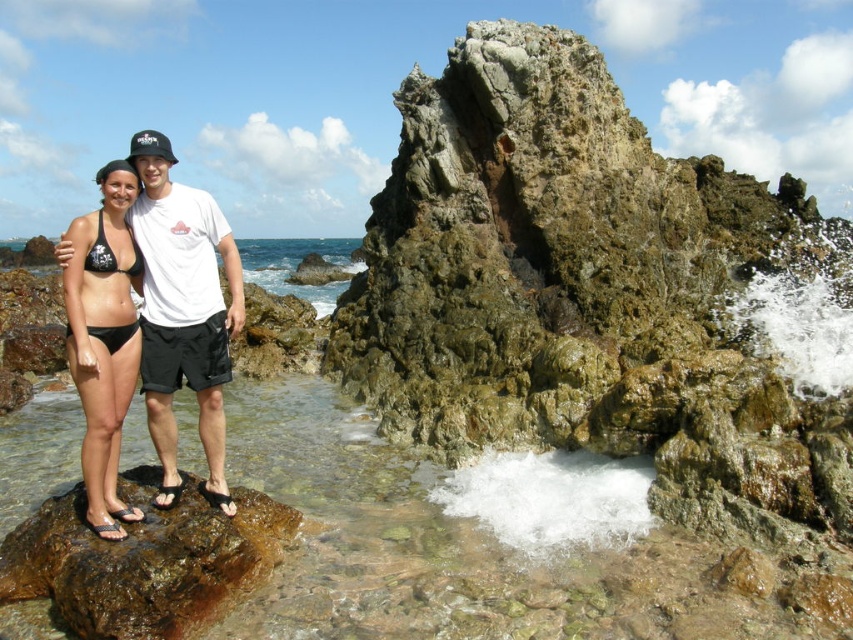
You are a photographer trying to capture both points in the image. Which point, point (395, 314) or point (67, 520), is closer to your camera lens?

Point (395, 314) is closer to the camera lens because it is further to the viewer than point (67, 520).

You are a photographer planning to take a portrait of the two people in the scene. You want to ensure that both the green mossy rock at center and the brown rough rock at lower left are visible in the background. Which rock will appear larger in the photo?

The green mossy rock at center will appear larger in the photo because it is taller than the brown rough rock at lower left.

You are a photographer trying to capture a shot of the brown rough rock at lower left and the matte black bikini at left. According to the scene, which object is positioned to the right of the other?

The brown rough rock at lower left is to the right of the matte black bikini at left.